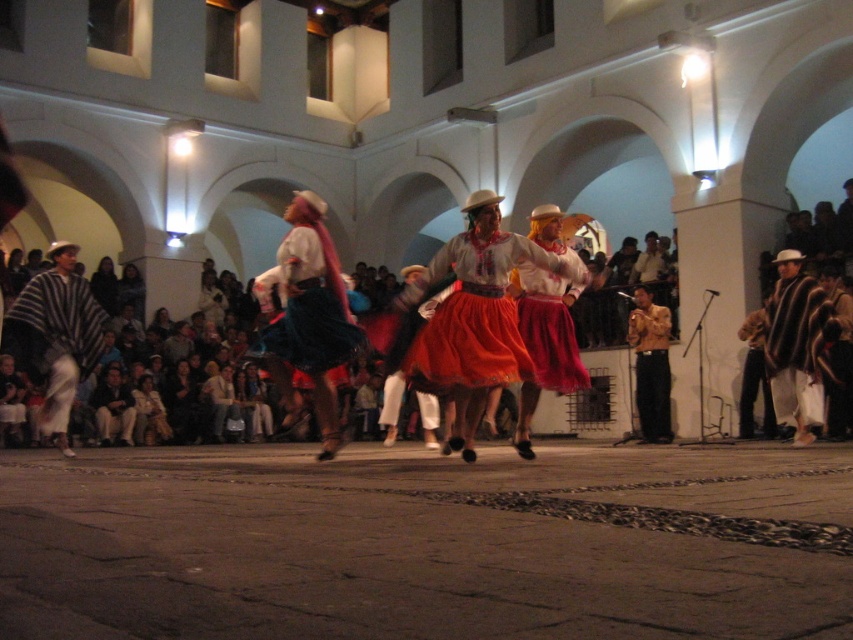
Question: Which object is closer to the camera taking this photo?

Choices:
 (A) red satin skirt at center
 (B) striped wool poncho at left
 (C) striped wool poncho at right
 (D) matte black dress at center

Answer: (A)

Question: Does matte black dress at center have a lesser width compared to matte blue skirt at center?

Choices:
 (A) yes
 (B) no

Answer: (A)

Question: Which point is farther to the camera?

Choices:
 (A) (177, 436)
 (B) (107, 264)

Answer: (B)

Question: Is matte orange skirt at center above matte red skirt at center?

Choices:
 (A) yes
 (B) no

Answer: (B)

Question: Considering the real-world distances, which object is farthest from the striped wool poncho at right?

Choices:
 (A) striped wool poncho at left
 (B) matte orange skirt at center

Answer: (A)

Question: Does striped wool poncho at left lie in front of matte red skirt at center?

Choices:
 (A) yes
 (B) no

Answer: (B)